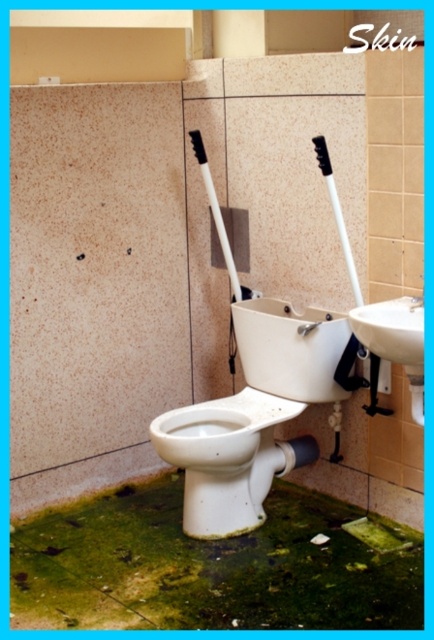
Question: Can you confirm if white glossy toilet at center is thinner than white glossy toilet bowl at center?

Choices:
 (A) yes
 (B) no

Answer: (B)

Question: Can you confirm if white glossy toilet at center is positioned above white glossy toilet bowl at center?

Choices:
 (A) no
 (B) yes

Answer: (B)

Question: Which point appears farthest from the camera in this image?

Choices:
 (A) (234, 304)
 (B) (269, 401)

Answer: (A)

Question: Can you confirm if white glossy toilet at center is positioned to the left of white glossy toilet bowl at center?

Choices:
 (A) no
 (B) yes

Answer: (A)